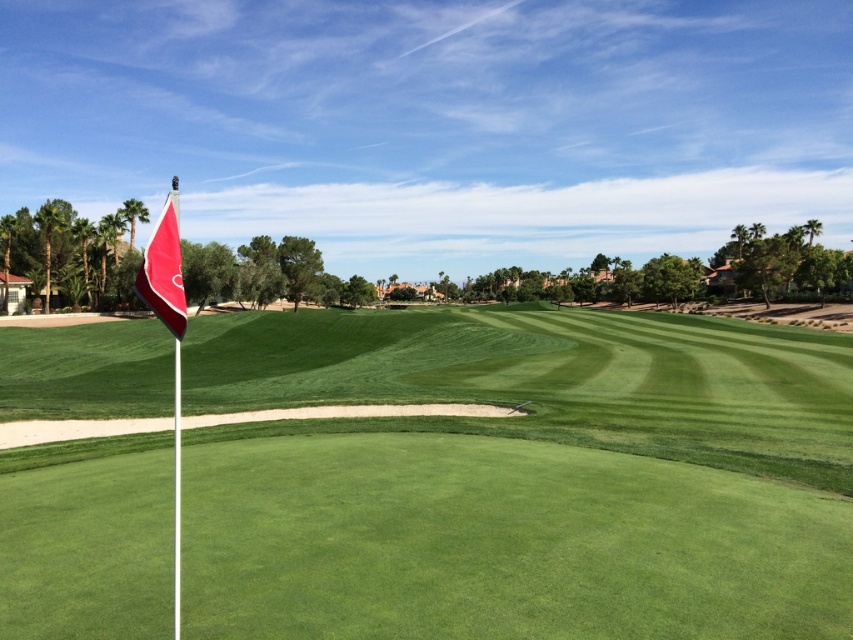
Does green grass at center appear under red matte flag at left?

Yes, green grass at center is below red matte flag at left.

Which is more to the right, green grass at center or red matte flag at left?

From the viewer's perspective, green grass at center appears more on the right side.

Which is behind, point (39, 474) or point (165, 317)?

The point (39, 474) is more distant.

Where is `green grass at center`? green grass at center is located at coordinates (518, 477).